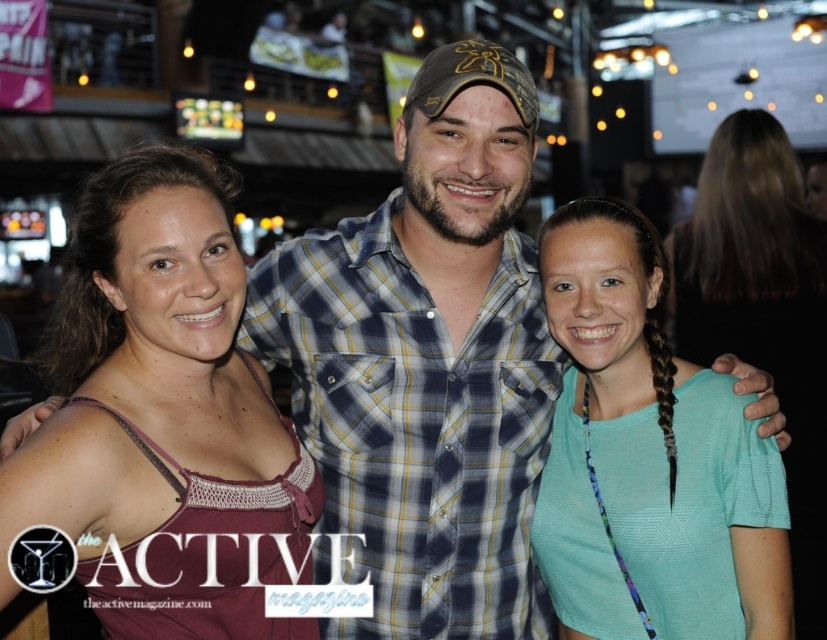
Question: Where is matte purple tank top at left located in relation to teal fabric shirt at center in the image?

Choices:
 (A) left
 (B) right

Answer: (A)

Question: Which point is farther to the camera?

Choices:
 (A) teal fabric shirt at center
 (B) matte purple tank top at left
 (C) teal fabric shirt at right

Answer: (A)

Question: Can you confirm if matte purple tank top at left is positioned below teal fabric shirt at center?

Choices:
 (A) yes
 (B) no

Answer: (B)

Question: Is teal fabric shirt at right positioned before teal fabric shirt at center?

Choices:
 (A) yes
 (B) no

Answer: (A)

Question: Which point appears closest to the camera in this image?

Choices:
 (A) (230, 317)
 (B) (811, 256)

Answer: (A)

Question: Based on their relative distances, which object is nearer to the matte purple tank top at left?

Choices:
 (A) teal fabric shirt at center
 (B) teal fabric shirt at right

Answer: (B)